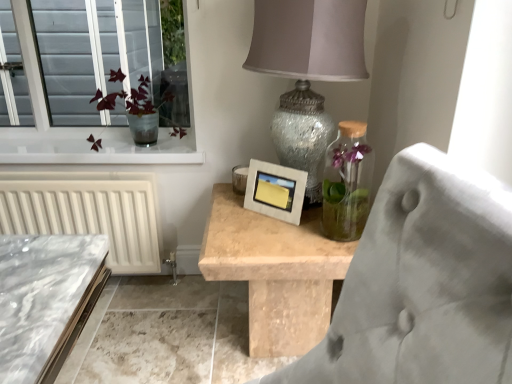
Question: Does matte concrete picture frame at center contain translucent glass vase at upper left?

Choices:
 (A) no
 (B) yes

Answer: (A)

Question: Is matte concrete picture frame at center not inside translucent glass vase at upper left?

Choices:
 (A) yes
 (B) no

Answer: (A)

Question: Can you confirm if matte concrete picture frame at center is wider than translucent glass vase at upper left?

Choices:
 (A) no
 (B) yes

Answer: (A)

Question: Does matte concrete picture frame at center come behind translucent glass vase at upper left?

Choices:
 (A) yes
 (B) no

Answer: (B)

Question: Is matte concrete picture frame at center placed right next to translucent glass vase at upper left?

Choices:
 (A) no
 (B) yes

Answer: (A)

Question: From the image's perspective, is speckled glass lampshade at upper center positioned above or below translucent glass vase at upper left?

Choices:
 (A) below
 (B) above

Answer: (A)

Question: Considering the positions of speckled glass lampshade at upper center and translucent glass vase at upper left in the image, is speckled glass lampshade at upper center bigger or smaller than translucent glass vase at upper left?

Choices:
 (A) small
 (B) big

Answer: (B)

Question: In the image, is speckled glass lampshade at upper center positioned in front of or behind translucent glass vase at upper left?

Choices:
 (A) behind
 (B) front

Answer: (B)

Question: Which is correct: speckled glass lampshade at upper center is inside translucent glass vase at upper left, or outside of it?

Choices:
 (A) inside
 (B) outside

Answer: (B)

Question: Considering the positions of translucent glass vase at upper left and speckled glass lampshade at upper center in the image, is translucent glass vase at upper left taller or shorter than speckled glass lampshade at upper center?

Choices:
 (A) short
 (B) tall

Answer: (A)

Question: Considering the positions of translucent glass vase at upper left and speckled glass lampshade at upper center in the image, is translucent glass vase at upper left wider or thinner than speckled glass lampshade at upper center?

Choices:
 (A) wide
 (B) thin

Answer: (B)

Question: Does point (119, 94) appear closer or farther from the camera than point (325, 122)?

Choices:
 (A) farther
 (B) closer

Answer: (A)

Question: From the image's perspective, is translucent glass vase at upper left positioned above or below speckled glass lampshade at upper center?

Choices:
 (A) above
 (B) below

Answer: (A)

Question: In terms of height, does speckled glass lampshade at upper center look taller or shorter compared to matte concrete picture frame at center?

Choices:
 (A) tall
 (B) short

Answer: (A)

Question: Is speckled glass lampshade at upper center inside the boundaries of matte concrete picture frame at center, or outside?

Choices:
 (A) outside
 (B) inside

Answer: (A)